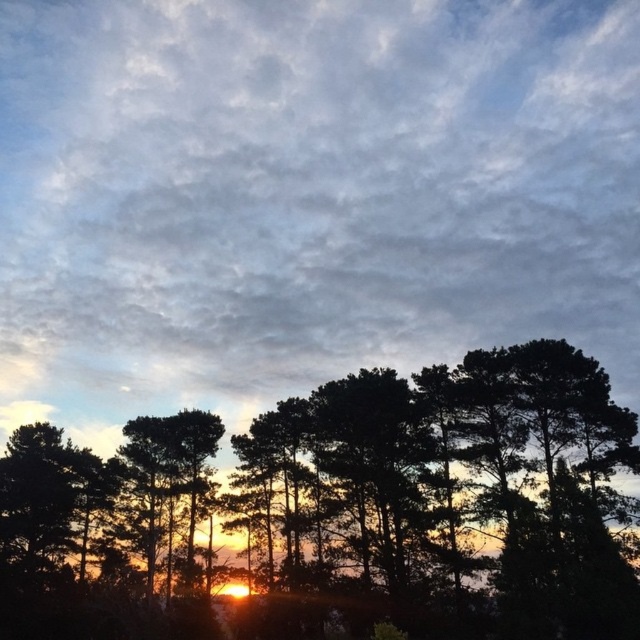
You are an astronomer observing the sunset scene. You notice a point at coordinates point (307,195). Can you determine which part of the sky this point corresponds to?

The cloudy sky at upper center is represented by point (307,195).

You are an artist painting the sunset scene. You want to paint the black matte tree at center in front of the cloudy sky at upper center. Is this possible based on the scene?

The black matte tree at center is behind cloudy sky at upper center, so it cannot be painted in front of it as it is positioned behind the sky in the scene.